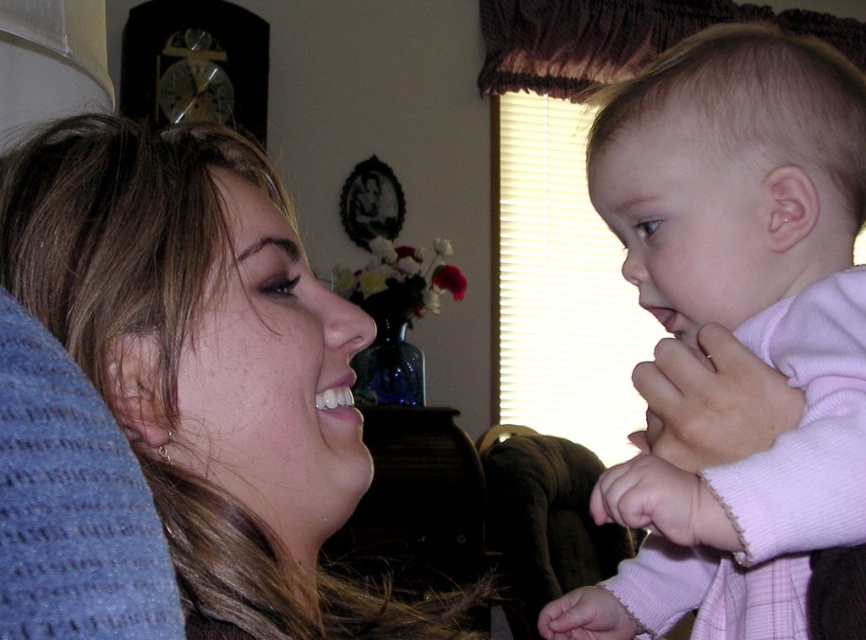
Question: Is matte blue pillow at lower left in front of pink fleece baby at center?

Choices:
 (A) no
 (B) yes

Answer: (B)

Question: Is matte blue pillow at lower left positioned at the back of pink fleece baby at center?

Choices:
 (A) no
 (B) yes

Answer: (A)

Question: Which object appears closest to the camera in this image?

Choices:
 (A) matte blue pillow at lower left
 (B) pink fleece baby at center

Answer: (A)

Question: Is matte blue pillow at lower left wider than pink fleece baby at center?

Choices:
 (A) yes
 (B) no

Answer: (A)

Question: Which of the following is the closest to the observer?

Choices:
 (A) (766, 150)
 (B) (65, 200)

Answer: (B)